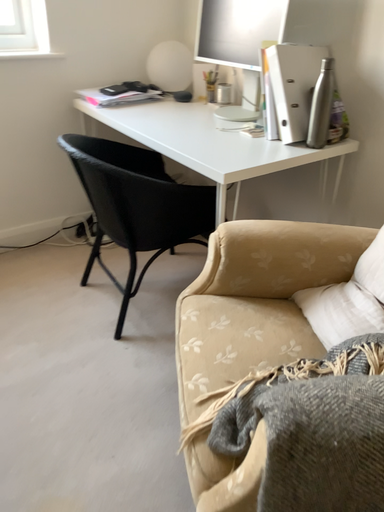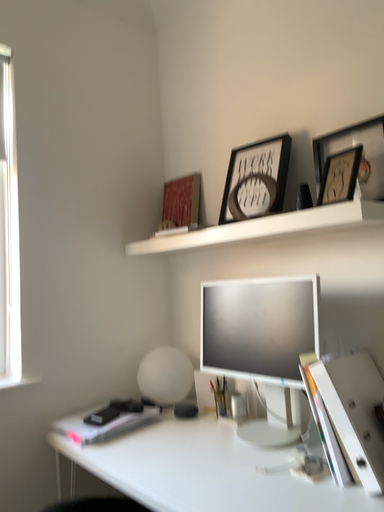
Question: Which way did the camera rotate in the video?

Choices:
 (A) rotated downward
 (B) rotated upward

Answer: (B)